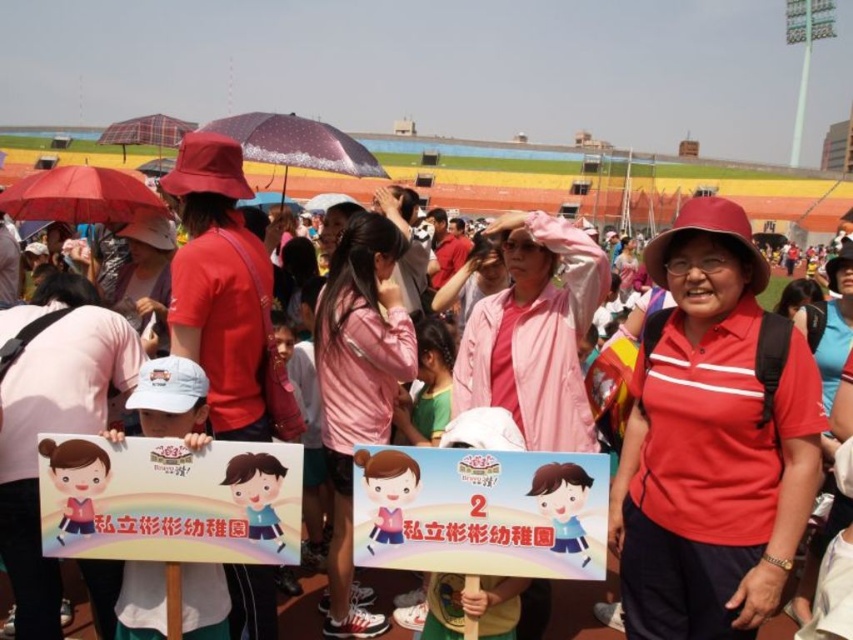
Where is the pink fabric jacket at center located in the image?

The pink fabric jacket at center is located at point 0.609 in the x coordinate and 0.421 in the y coordinate.

You are a photographer standing at the edge of the stadium track. You want to take a clear photo of the pink fabric jacket at center from your current position. Considering the distance, is it feasible to capture a detailed image without zooming?

The pink fabric jacket at center is 38.60 meters away from the viewer. Without zooming, capturing a detailed image from this distance may be challenging due to the significant distance involved.